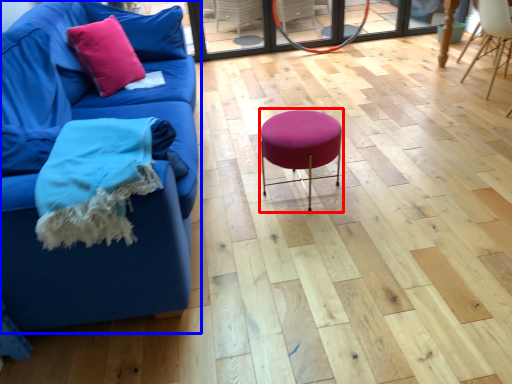
Question: Which object is closer to the camera taking this photo, bar stool (highlighted by a red box) or studio couch (highlighted by a blue box)?

Choices:
 (A) bar stool
 (B) studio couch

Answer: (B)